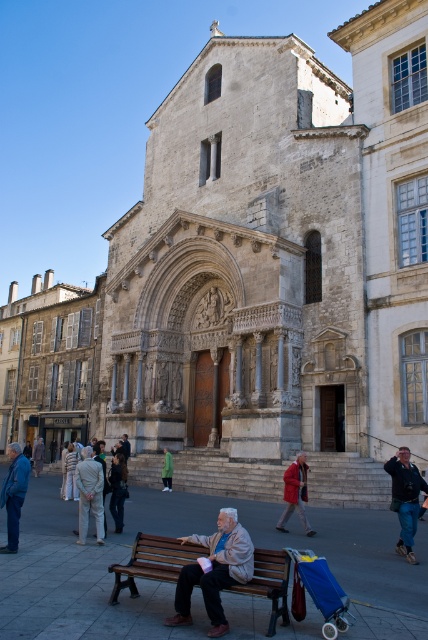
Measure the distance between blue fabric stroller at lower right and matte red coat at center.

blue fabric stroller at lower right and matte red coat at center are 17.93 meters apart from each other.

Between blue fabric stroller at lower right and matte red coat at center, which one has less height?

blue fabric stroller at lower right is shorter.

Is point (321, 586) behind point (294, 506)?

No, it is in front of (294, 506).

Locate an element on the screen. The width and height of the screenshot is (428, 640). blue fabric stroller at lower right is located at coordinates point(323,589).

Who is shorter, light beige suit at lower left or matte red coat at center?

matte red coat at center

Which is behind, point (95, 502) or point (303, 496)?

Point (303, 496)

The width and height of the screenshot is (428, 640). Identify the location of light beige suit at lower left. (89, 493).

Between point (163, 547) and point (303, 570), which one is positioned behind?

Point (163, 547)

Does point (196, 552) lie in front of point (329, 602)?

That is False.

Is point (240, 593) closer to viewer compared to point (332, 577)?

No, it is not.

You are a GUI agent. You are given a task and a screenshot of the screen. Output one action in this format:
    pyautogui.click(x=<x>, y=<y>)
    Task: Click on the brown wooden bench at lower center
    This screenshot has height=640, width=428.
    Given the screenshot: What is the action you would take?
    pyautogui.click(x=152, y=561)